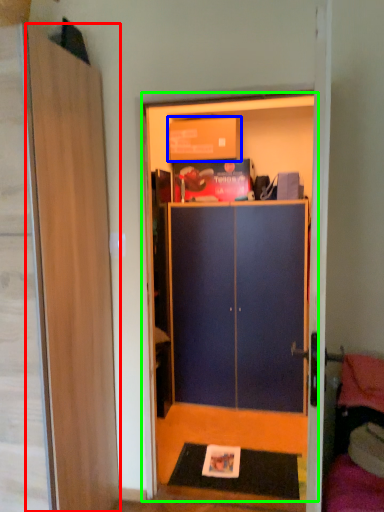
Question: Considering the real-world distances, which object is farthest from door (highlighted by a red box)? cardboard box (highlighted by a blue box) or dresser (highlighted by a green box)?

Choices:
 (A) cardboard box
 (B) dresser

Answer: (B)